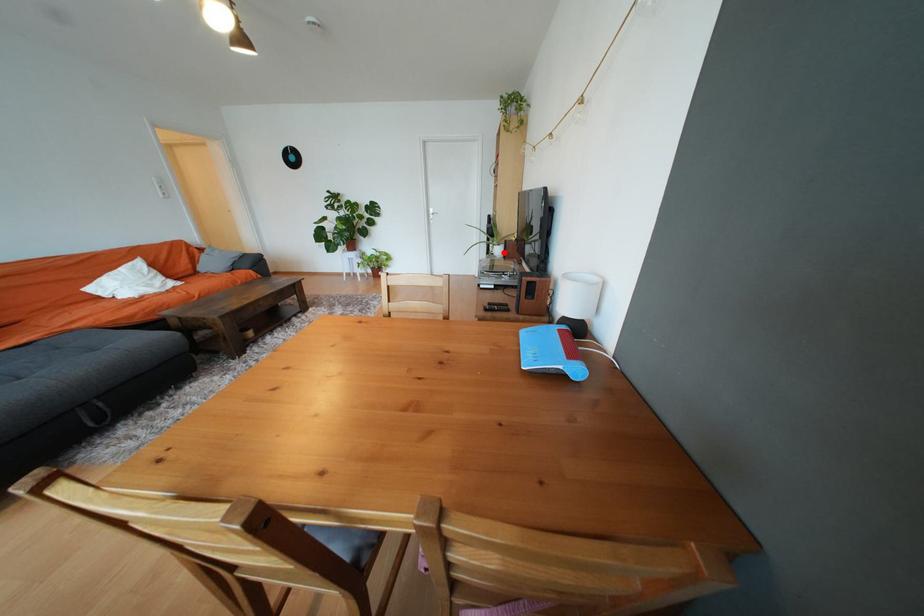
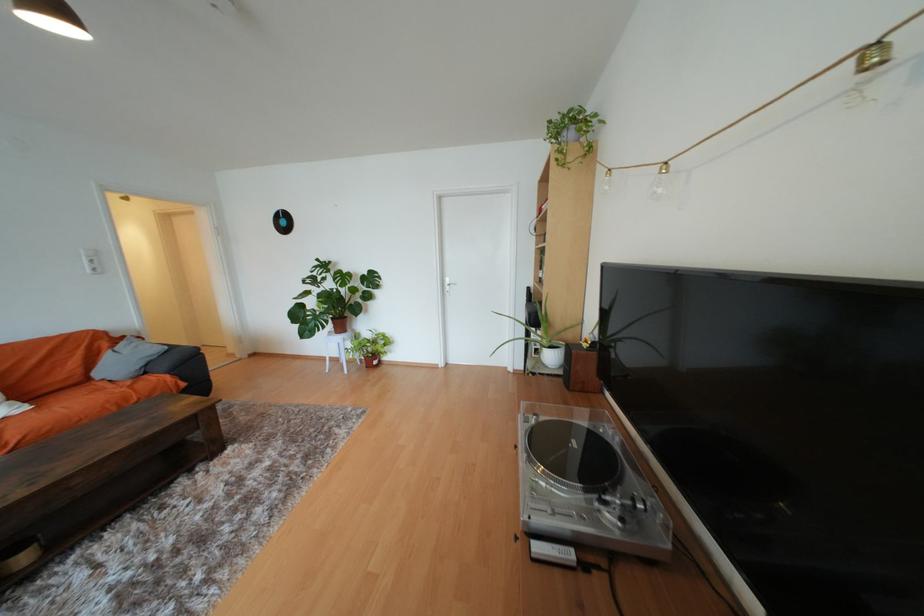
The point at the highlighted location is marked in the first image. Where is the corresponding point in the second image?

(556, 359)